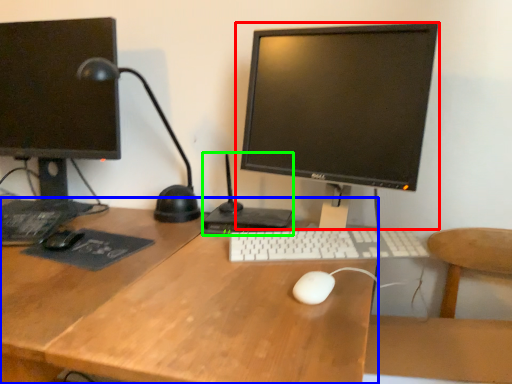
Question: Estimate the real-world distances between objects in this image. Which object is farther from computer monitor (highlighted by a red box), desk (highlighted by a blue box) or computer (highlighted by a green box)?

Choices:
 (A) desk
 (B) computer

Answer: (A)